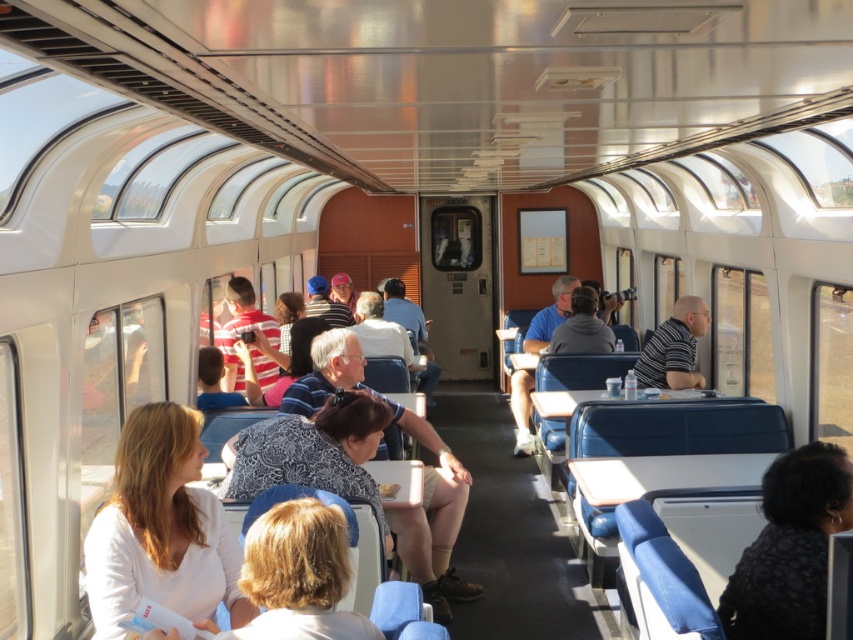
You are a passenger on the train and want to find a seat. You see a black textured shirt at lower right and a striped cotton shirt at center. Which shirt is closer to the floor?

The black textured shirt at lower right is positioned under the striped cotton shirt at center, so it is closer to the floor.

You are a passenger on the train and want to store your bag in the overhead compartment. You notice the white matte shirt at lower left and the striped cotton shirt at center are near the compartment. Which shirt is closer to the overhead compartment?

The white matte shirt at lower left is closer to the overhead compartment because it occupies less space than the striped cotton shirt at center, which might be positioned further away.